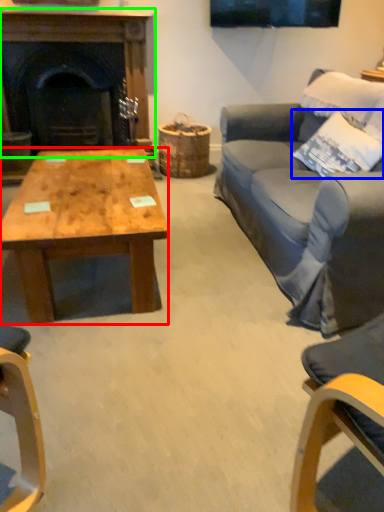
Question: Which is farther away from coffee table (highlighted by a red box)? pillow (highlighted by a blue box) or fireplace (highlighted by a green box)?

Choices:
 (A) pillow
 (B) fireplace

Answer: (B)